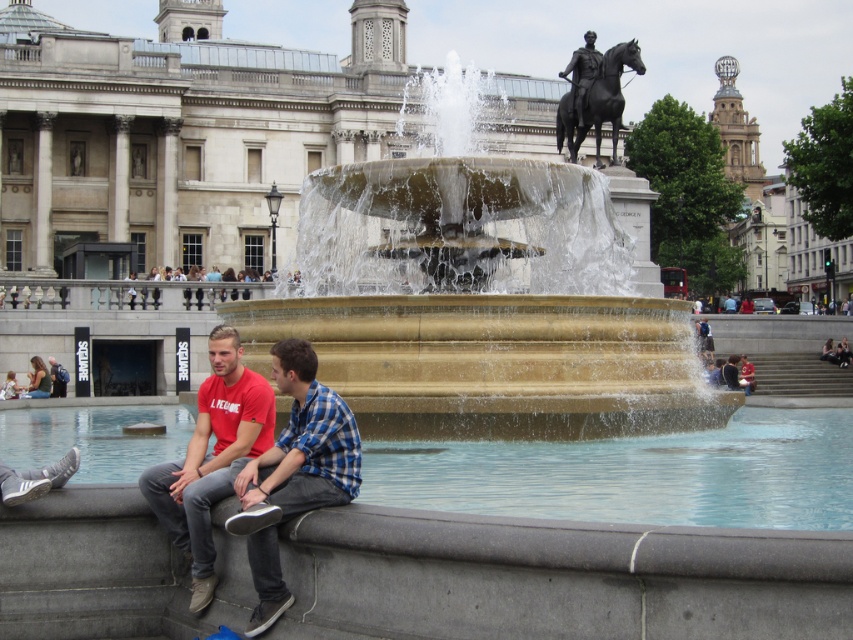
Question: Is polished bronze statue at upper center positioned before matte black jacket at lower left?

Choices:
 (A) no
 (B) yes

Answer: (A)

Question: Which object is the farthest from the matte red t-shirt at lower left?

Choices:
 (A) polished bronze statue at upper center
 (B) matte black jacket at lower left
 (C) golden stone fountain at center

Answer: (A)

Question: Which is farther from the golden stone fountain at center?

Choices:
 (A) polished bronze statue at upper center
 (B) matte red t-shirt at lower left
 (C) red cotton shirt at lower left

Answer: (A)

Question: Is matte red t-shirt at lower left smaller than polished bronze horse at upper center?

Choices:
 (A) yes
 (B) no

Answer: (A)

Question: Can you confirm if polished bronze statue at upper center is positioned to the left of matte black jacket at lower left?

Choices:
 (A) yes
 (B) no

Answer: (B)

Question: Which point is closer to the camera?

Choices:
 (A) (28, 394)
 (B) (618, 83)

Answer: (A)